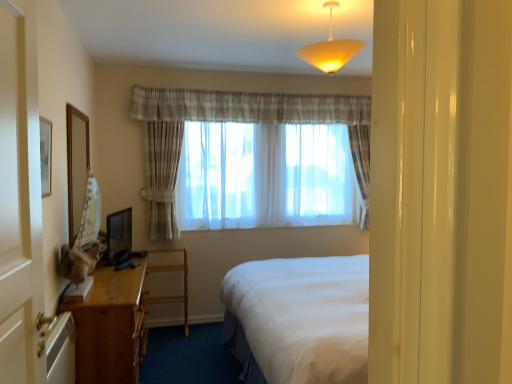
Question: Is wooden mirror at left not inside wooden desk at lower left?

Choices:
 (A) no
 (B) yes

Answer: (B)

Question: Is wooden desk at lower left at the back of wooden mirror at left?

Choices:
 (A) no
 (B) yes

Answer: (A)

Question: Considering the relative sizes of wooden mirror at left and wooden desk at lower left in the image provided, is wooden mirror at left smaller than wooden desk at lower left?

Choices:
 (A) no
 (B) yes

Answer: (B)

Question: Is wooden mirror at left to the right of wooden desk at lower left from the viewer's perspective?

Choices:
 (A) no
 (B) yes

Answer: (A)

Question: Does wooden mirror at left have a lesser height compared to wooden desk at lower left?

Choices:
 (A) yes
 (B) no

Answer: (A)

Question: In the image, is sheer fabric curtains at center positioned in front of or behind wooden desk at left?

Choices:
 (A) front
 (B) behind

Answer: (B)

Question: Is point (167, 188) closer or farther from the camera than point (102, 342)?

Choices:
 (A) farther
 (B) closer

Answer: (A)

Question: From the image's perspective, is sheer fabric curtains at center located above or below wooden desk at left?

Choices:
 (A) below
 (B) above

Answer: (B)

Question: From a real-world perspective, is sheer fabric curtains at center physically located above or below wooden desk at left?

Choices:
 (A) below
 (B) above

Answer: (B)

Question: Considering the positions of wooden desk at left and wooden mirror at left in the image, is wooden desk at left taller or shorter than wooden mirror at left?

Choices:
 (A) tall
 (B) short

Answer: (A)

Question: From the image's perspective, is wooden desk at left above or below wooden mirror at left?

Choices:
 (A) below
 (B) above

Answer: (A)

Question: Does point (123, 357) appear closer or farther from the camera than point (69, 200)?

Choices:
 (A) closer
 (B) farther

Answer: (A)

Question: Looking at the image, does wooden desk at left seem bigger or smaller compared to wooden mirror at left?

Choices:
 (A) small
 (B) big

Answer: (B)

Question: Is matte yellow glass lampshade at upper center inside the boundaries of wooden desk at lower left, or outside?

Choices:
 (A) inside
 (B) outside

Answer: (B)

Question: Is matte yellow glass lampshade at upper center taller or shorter than wooden desk at lower left?

Choices:
 (A) short
 (B) tall

Answer: (A)